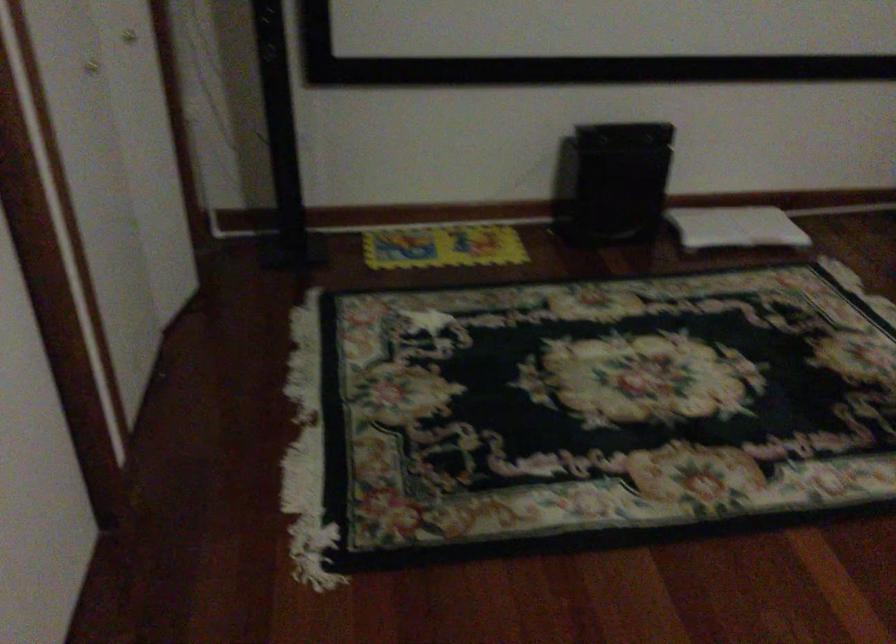
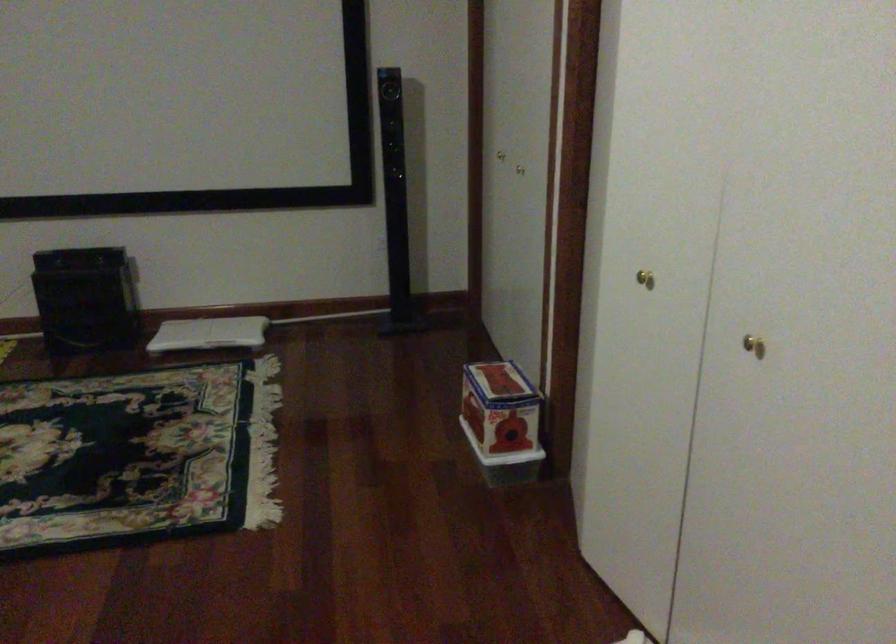
Question: In a continuous first-person perspective shot, in which direction is the camera moving?

Choices:
 (A) Left
 (B) Right
 (C) Forward
 (D) Backward

Answer: (B)